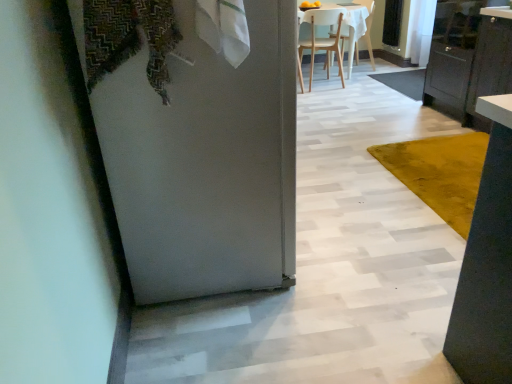
At what (x,y) coordinates should I click in order to perform the action: click on white matte chair at upper center, the first chair in the left-to-right sequence. Please return your answer as a coordinate pair (x, y). The image size is (512, 384). Looking at the image, I should click on click(323, 40).

Identify the location of black glossy cabinet at right. Image resolution: width=512 pixels, height=384 pixels. coord(466,57).

Find the location of a particular element. Image resolution: width=512 pixels, height=384 pixels. yellow velvet rug at center is located at coordinates (440, 172).

Where is `wooden chair at upper center, which is the first chair in right-to-left order`? wooden chair at upper center, which is the first chair in right-to-left order is located at coordinates (350, 44).

This screenshot has height=384, width=512. I want to click on white matte door at left, so click(x=206, y=162).

The height and width of the screenshot is (384, 512). Find the location of `door behind the patterned fabric laundry at upper left`. door behind the patterned fabric laundry at upper left is located at coordinates (206, 162).

Between patterned fabric laundry at upper left and white matte door at left, which one is positioned behind?

white matte door at left.

Can you confirm if patterned fabric laundry at upper left is wider than white matte door at left?

No, patterned fabric laundry at upper left is not wider than white matte door at left.

Considering the sizes of objects patterned fabric laundry at upper left and white matte door at left in the image provided, who is taller, patterned fabric laundry at upper left or white matte door at left?

white matte door at left.

Considering the positions of objects wooden chair at upper center, which is the first chair in right-to-left order, and white matte chair at upper center, the first chair in the left-to-right sequence, in the image provided, who is more to the left, wooden chair at upper center, which is the first chair in right-to-left order, or white matte chair at upper center, the first chair in the left-to-right sequence,?

From the viewer's perspective, white matte chair at upper center, the first chair in the left-to-right sequence, appears more on the left side.

Looking at this image, which object is closer to the camera taking this photo, wooden chair at upper center, which is the first chair in right-to-left order, or white matte chair at upper center, the first chair in the left-to-right sequence?

white matte chair at upper center, the first chair in the left-to-right sequence, is closer to the camera.

Is white matte chair at upper center, the 2th chair when ordered from right to left, at the back of wooden chair at upper center, which is the first chair in right-to-left order?

No, wooden chair at upper center, which is the first chair in right-to-left order,'s orientation is not away from white matte chair at upper center, the 2th chair when ordered from right to left.

Looking at this image, from the image's perspective, relative to white matte chair at upper center, the first chair in the left-to-right sequence, is wooden chair at upper center, positioned as the second chair in left-to-right order, above or below?

From the image's perspective, wooden chair at upper center, positioned as the second chair in left-to-right order, appears above white matte chair at upper center, the first chair in the left-to-right sequence.

From the image's perspective, between yellow velvet rug at center and patterned fabric laundry at upper left, who is located below?

yellow velvet rug at center.

Which object is further away from the camera taking this photo, yellow velvet rug at center or patterned fabric laundry at upper left?

yellow velvet rug at center is more distant.

Where is `laundry above the yellow velvet rug at center (from a real-world perspective)`? The width and height of the screenshot is (512, 384). laundry above the yellow velvet rug at center (from a real-world perspective) is located at coordinates coord(130,38).

Is wooden chair at upper center, positioned as the second chair in left-to-right order, directly adjacent to patterned fabric laundry at upper left?

No, wooden chair at upper center, positioned as the second chair in left-to-right order, is not beside patterned fabric laundry at upper left.

From a real-world perspective, count 2nd chairs downward from the patterned fabric laundry at upper left and point to it. Please provide its 2D coordinates.

[(350, 44)]

Is patterned fabric laundry at upper left at the back of wooden chair at upper center, which is the first chair in right-to-left order?

No, wooden chair at upper center, which is the first chair in right-to-left order, is not facing the opposite direction of patterned fabric laundry at upper left.

From a real-world perspective, is white matte chair at upper center, the first chair in the left-to-right sequence, on top of black glossy cabinet at right?

Incorrect, from a real-world perspective, white matte chair at upper center, the first chair in the left-to-right sequence, is lower than black glossy cabinet at right.

Looking at their sizes, would you say white matte chair at upper center, the first chair in the left-to-right sequence, is wider or thinner than black glossy cabinet at right?

Considering their sizes, white matte chair at upper center, the first chair in the left-to-right sequence, looks slimmer than black glossy cabinet at right.

Which is behind, white matte chair at upper center, the first chair in the left-to-right sequence, or black glossy cabinet at right?

white matte chair at upper center, the first chair in the left-to-right sequence.

Which object is closer to the camera, clear glass screen door at upper right or patterned fabric laundry at upper left?

patterned fabric laundry at upper left is closer to the camera.

From a real-world perspective, relative to patterned fabric laundry at upper left, is clear glass screen door at upper right vertically above or below?

clear glass screen door at upper right is situated lower than patterned fabric laundry at upper left in the real world.

From the image's perspective, which is above, clear glass screen door at upper right or patterned fabric laundry at upper left?

clear glass screen door at upper right, from the image's perspective.

Is clear glass screen door at upper right wider or thinner than patterned fabric laundry at upper left?

In the image, clear glass screen door at upper right appears to be more narrow than patterned fabric laundry at upper left.

Would you say wooden chair at upper center, positioned as the second chair in left-to-right order, is inside or outside black glossy cabinet at right?

wooden chair at upper center, positioned as the second chair in left-to-right order, is spatially situated outside black glossy cabinet at right.

Considering the sizes of objects wooden chair at upper center, which is the first chair in right-to-left order, and black glossy cabinet at right in the image provided, who is thinner, wooden chair at upper center, which is the first chair in right-to-left order, or black glossy cabinet at right?

With smaller width is wooden chair at upper center, which is the first chair in right-to-left order.

Does wooden chair at upper center, which is the first chair in right-to-left order, have a greater height compared to black glossy cabinet at right?

In fact, wooden chair at upper center, which is the first chair in right-to-left order, may be shorter than black glossy cabinet at right.

Can you tell me how much wooden chair at upper center, positioned as the second chair in left-to-right order, and black glossy cabinet at right differ in facing direction?

There is a 5.29-degree angle between the facing directions of wooden chair at upper center, positioned as the second chair in left-to-right order, and black glossy cabinet at right.

Identify the location of door below the patterned fabric laundry at upper left (from the image's perspective). Image resolution: width=512 pixels, height=384 pixels. (206, 162).

At what (x,y) coordinates should I click in order to perform the action: click on chair in front of the wooden chair at upper center, positioned as the second chair in left-to-right order. Please return your answer as a coordinate pair (x, y). Looking at the image, I should click on (323, 40).

From the image, which object appears to be nearer to yellow velvet rug at center, white matte door at left or white matte chair at upper center, the 2th chair when ordered from right to left?

The object closer to yellow velvet rug at center is white matte door at left.

Looking at the image, which one is located further to patterned fabric laundry at upper left, clear glass screen door at upper right or white matte door at left?

The object further to patterned fabric laundry at upper left is clear glass screen door at upper right.

Estimate the real-world distances between objects in this image. Which object is closer to patterned fabric laundry at upper left, black glossy cabinet at right or clear glass screen door at upper right?

black glossy cabinet at right.

Which object lies further to the anchor point white matte chair at upper center, the 2th chair when ordered from right to left, patterned fabric laundry at upper left or wooden chair at upper center, which is the first chair in right-to-left order?

Based on the image, patterned fabric laundry at upper left appears to be further to white matte chair at upper center, the 2th chair when ordered from right to left.

When comparing their distances from wooden chair at upper center, positioned as the second chair in left-to-right order, does black glossy cabinet at right or white matte door at left seem closer?

Among the two, black glossy cabinet at right is located nearer to wooden chair at upper center, positioned as the second chair in left-to-right order.

Considering their positions, is wooden chair at upper center, positioned as the second chair in left-to-right order, positioned closer to white matte door at left than yellow velvet rug at center?

The object closer to white matte door at left is yellow velvet rug at center.

Which object lies further to the anchor point white matte door at left, wooden chair at upper center, which is the first chair in right-to-left order, or patterned fabric laundry at upper left?

The object further to white matte door at left is wooden chair at upper center, which is the first chair in right-to-left order.

Considering their positions, is patterned fabric laundry at upper left positioned closer to white matte door at left than yellow velvet rug at center?

patterned fabric laundry at upper left is closer to white matte door at left.

Locate an element on the screen. chair located between yellow velvet rug at center and wooden chair at upper center, which is the first chair in right-to-left order, in the depth direction is located at coordinates (323, 40).

What are the coordinates of `chair located between white matte chair at upper center, the 2th chair when ordered from right to left, and clear glass screen door at upper right in the left-right direction` in the screenshot? It's located at (350, 44).

This screenshot has height=384, width=512. I want to click on door located between patterned fabric laundry at upper left and yellow velvet rug at center in the left-right direction, so click(x=206, y=162).

Identify the location of cabinetry between white matte door at left and wooden chair at upper center, positioned as the second chair in left-to-right order, in the front-back direction. Image resolution: width=512 pixels, height=384 pixels. (466, 57).